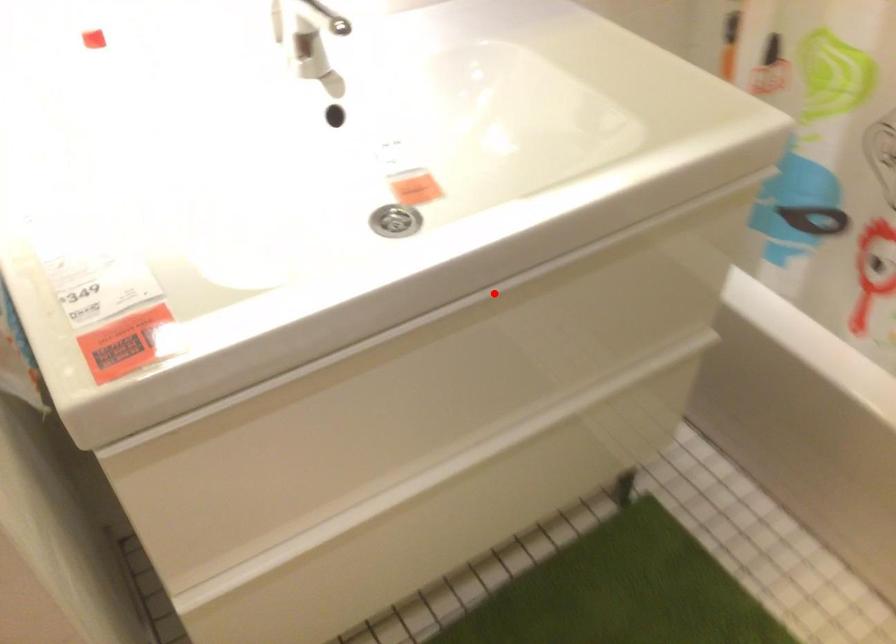
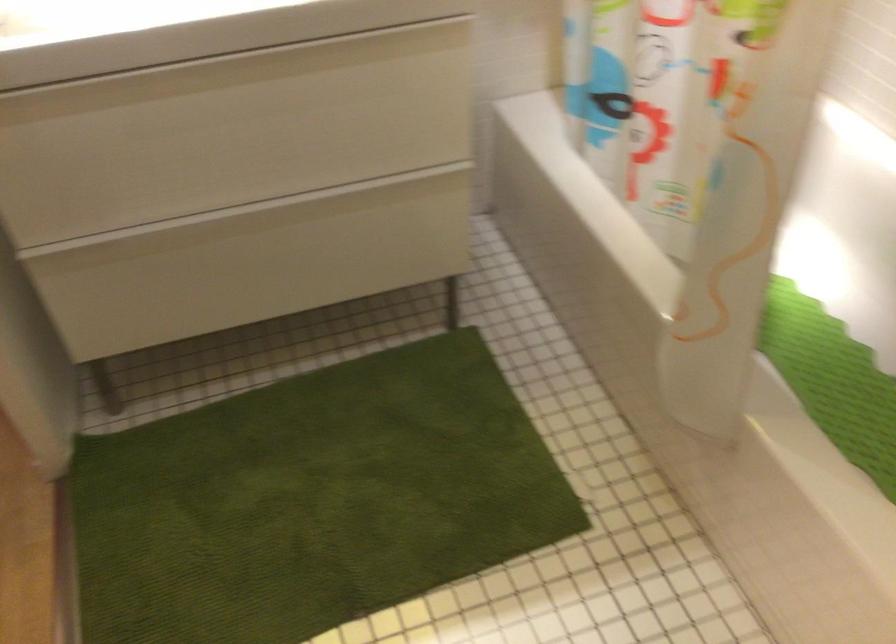
Where in the second image is the point corresponding to the highlighted location from the first image?

(228, 70)